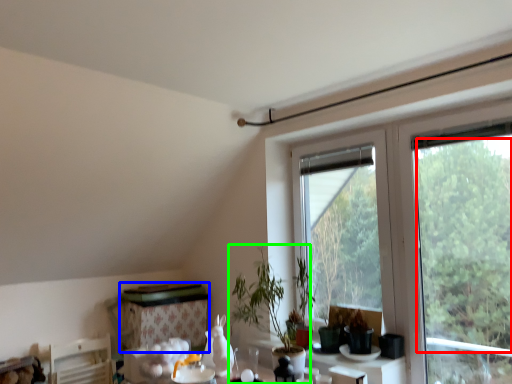
Question: Considering the real-world distances, which object is closest to tree (highlighted by a red box)? table (highlighted by a blue box) or houseplant (highlighted by a green box).

Choices:
 (A) table
 (B) houseplant

Answer: (B)